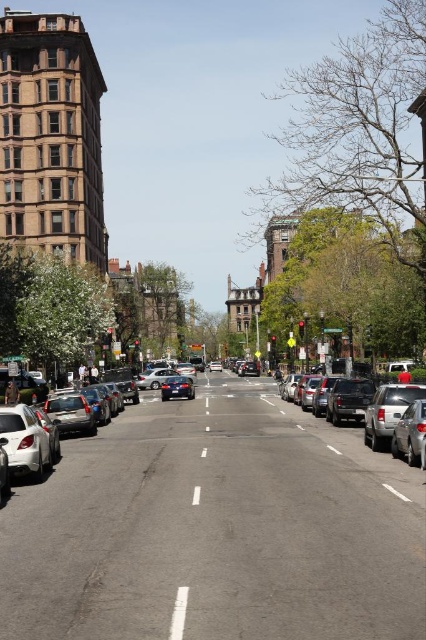
Is point (186, 588) farther from camera compared to point (178, 396)?

No, (186, 588) is closer to viewer.

Can you confirm if white smooth line at center is wider than shiny silver sedan at center?

In fact, white smooth line at center might be narrower than shiny silver sedan at center.

I want to click on white smooth line at center, so click(178, 612).

Between silver metallic sedan at right and white smooth line at center, which one appears on the left side from the viewer's perspective?

white smooth line at center is more to the left.

Which is in front, point (362, 417) or point (178, 596)?

Point (178, 596) is in front.

Image resolution: width=426 pixels, height=640 pixels. Identify the location of silver metallic sedan at right. (373, 408).

Between silver metallic sedan at right and shiny silver sedan at center, which one is positioned higher?

Positioned higher is silver metallic sedan at right.

Is silver metallic sedan at right above shiny silver sedan at center?

Yes.

Identify the location of silver metallic sedan at right. This screenshot has width=426, height=640. (373, 408).